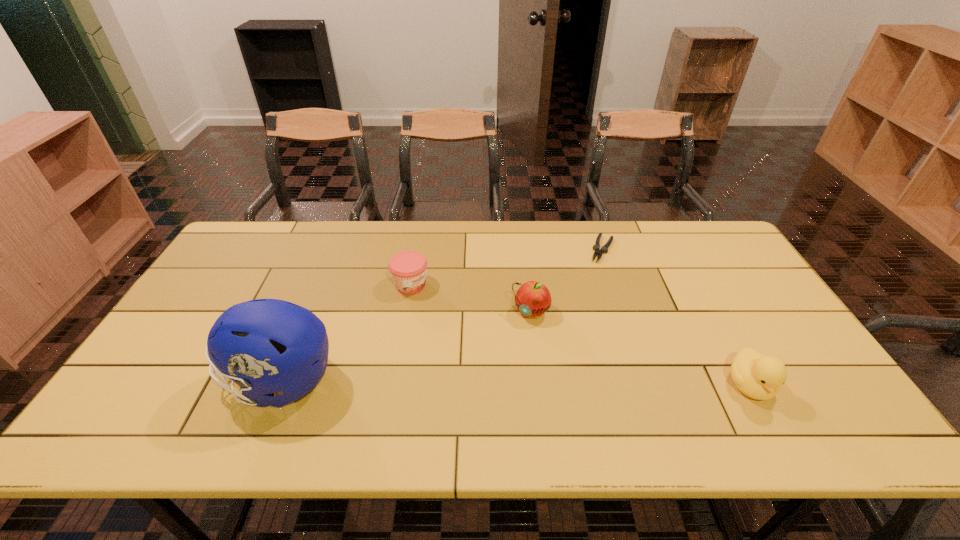
Locate an element on the screen. The width and height of the screenshot is (960, 540). the second closest object relative to the fourth tallest object is located at coordinates (532, 299).

Select which object appears as the fourth closest to the football helmet. Please provide its 2D coordinates. Your answer should be formatted as a tuple, i.e. [(x, y)], where the tuple contains the x and y coordinates of a point satisfying the conditions above.

[(760, 377)]